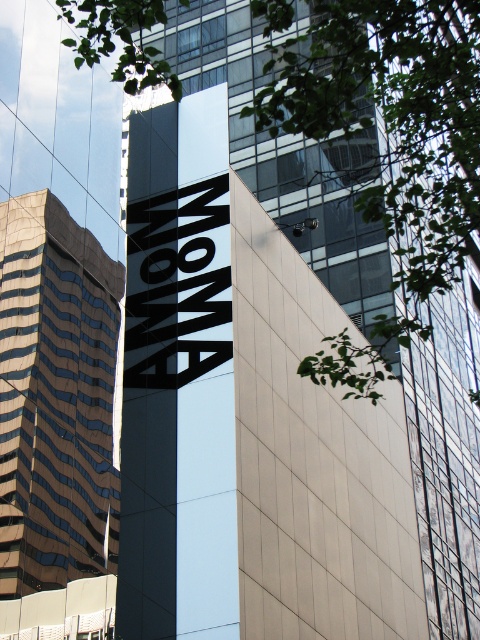
Question: Which point is closer to the camera?

Choices:
 (A) brown glass building at left
 (B) green leafy tree at upper center
 (C) black matte sign at center

Answer: (B)

Question: Can you confirm if green leafy tree at upper center is positioned to the left of brown glass building at left?

Choices:
 (A) yes
 (B) no

Answer: (B)

Question: Can you confirm if brown glass building at left is positioned above black matte sign at center?

Choices:
 (A) no
 (B) yes

Answer: (A)

Question: Is green leafy tree at upper center smaller than black matte sign at center?

Choices:
 (A) yes
 (B) no

Answer: (B)

Question: Which point appears closest to the camera in this image?

Choices:
 (A) (98, 20)
 (B) (107, 392)

Answer: (B)

Question: Based on their relative distances, which object is nearer to the green leafy tree at upper center?

Choices:
 (A) black matte sign at center
 (B) brown glass building at left

Answer: (A)